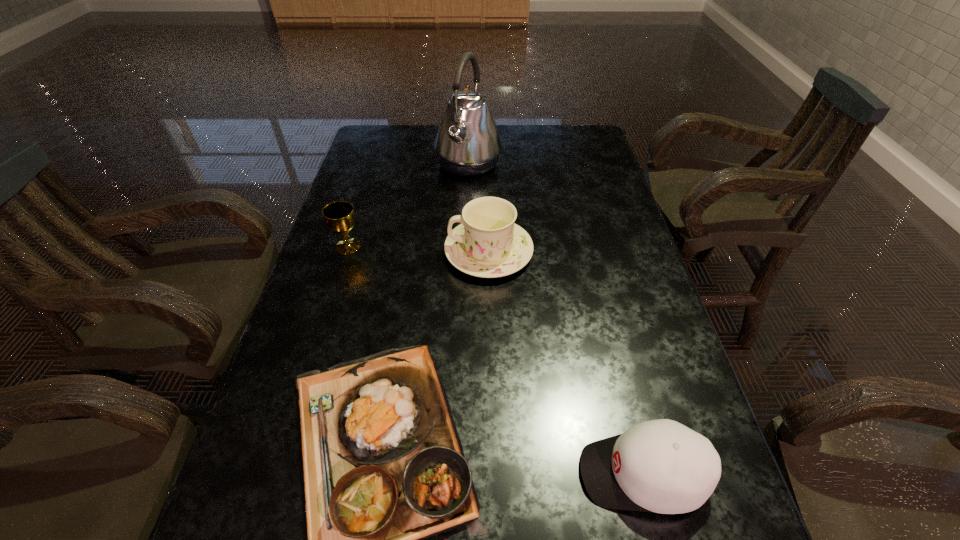
In the image, there is a desktop. Identify the location of free space at the far right corner. This screenshot has height=540, width=960. (564, 133).

Identify the location of blank region between the chinaware and the rightmost object. (565, 363).

I want to click on free space between the chalice and the rightmost object, so click(495, 360).

The width and height of the screenshot is (960, 540). I want to click on vacant space that is in between the chalice and the rightmost object, so point(495,360).

This screenshot has height=540, width=960. I want to click on free space between the chalice and the kettle, so click(408, 205).

Identify the location of unoccupied position between the kettle and the chalice. (408, 205).

Where is `free space between the chinaware and the chalice`? free space between the chinaware and the chalice is located at coordinates [419, 249].

Locate an element on the screen. free spot between the tallest object and the baseball cap is located at coordinates (555, 319).

This screenshot has width=960, height=540. What are the coordinates of `object that is the second closest to the chinaware` in the screenshot? It's located at (467, 143).

You are a GUI agent. You are given a task and a screenshot of the screen. Output one action in this format:
    pyautogui.click(x=<x>, y=<y>)
    Task: Click on the object that stands as the closest to the chalice
    Image resolution: width=960 pixels, height=540 pixels.
    Given the screenshot: What is the action you would take?
    point(488,244)